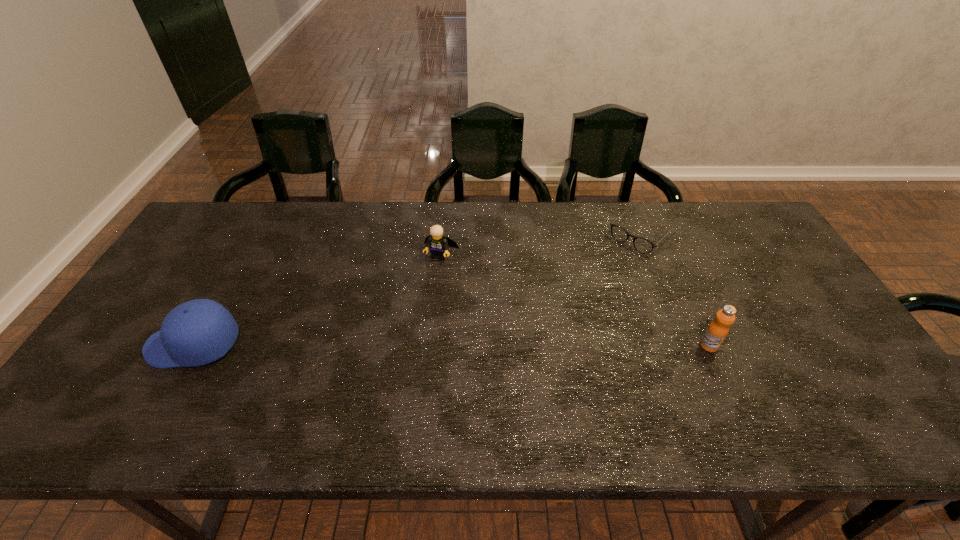
This screenshot has height=540, width=960. What are the coordinates of `blank space located on the front-facing side of the Lego` in the screenshot? It's located at (426, 287).

Image resolution: width=960 pixels, height=540 pixels. I want to click on spectacles present at the far edge, so click(x=642, y=245).

You are a GUI agent. You are given a task and a screenshot of the screen. Output one action in this format:
    pyautogui.click(x=<x>, y=<y>)
    Task: Click on the Lego that is at the far edge
    This screenshot has height=540, width=960.
    Given the screenshot: What is the action you would take?
    pyautogui.click(x=438, y=244)

This screenshot has height=540, width=960. In order to click on object at the near edge in this screenshot , I will do [197, 332].

This screenshot has width=960, height=540. What are the coordinates of `object located in the left edge section of the desktop` in the screenshot? It's located at (197, 332).

Locate an element on the screen. Image resolution: width=960 pixels, height=540 pixels. object at the near left corner is located at coordinates (197, 332).

In the image, there is a desktop. Identify the location of vacant region at the far edge. This screenshot has width=960, height=540. (414, 222).

This screenshot has height=540, width=960. In the image, there is a desktop. In order to click on vacant space at the near edge in this screenshot , I will do `click(444, 395)`.

This screenshot has width=960, height=540. In the image, there is a desktop. What are the coordinates of `vacant area at the right edge` in the screenshot? It's located at [x=790, y=290].

This screenshot has height=540, width=960. What are the coordinates of `vacant space at the far left corner` in the screenshot? It's located at (220, 242).